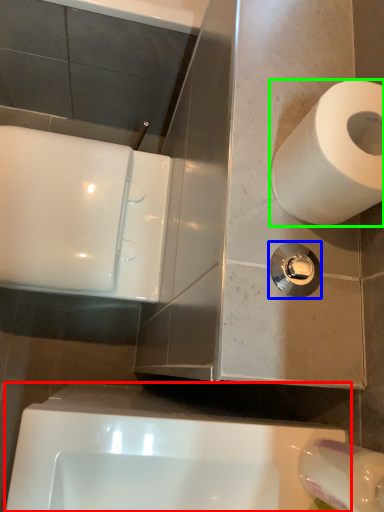
Question: Which is nearer to the bath (highlighted by a red box)? plumbing fixture (highlighted by a blue box) or toilet paper (highlighted by a green box).

Choices:
 (A) plumbing fixture
 (B) toilet paper

Answer: (A)